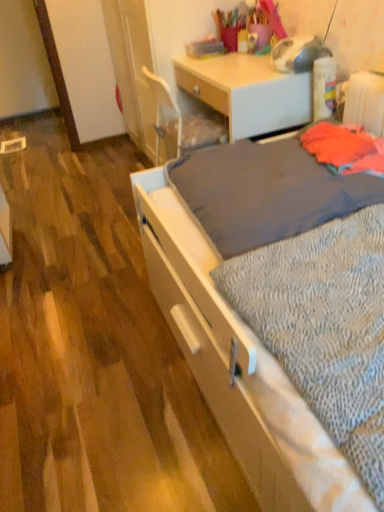
Question: Is matte wood desk at center far away from textured gray blanket at center?

Choices:
 (A) no
 (B) yes

Answer: (A)

Question: Considering the relative sizes of matte wood desk at center and textured gray blanket at center in the image provided, is matte wood desk at center wider than textured gray blanket at center?

Choices:
 (A) yes
 (B) no

Answer: (B)

Question: Considering the relative sizes of matte wood desk at center and textured gray blanket at center in the image provided, is matte wood desk at center smaller than textured gray blanket at center?

Choices:
 (A) yes
 (B) no

Answer: (B)

Question: Is the depth of matte wood desk at center less than that of textured gray blanket at center?

Choices:
 (A) yes
 (B) no

Answer: (B)

Question: Could textured gray blanket at center be considered to be inside matte wood desk at center?

Choices:
 (A) yes
 (B) no

Answer: (B)

Question: Is matte wood desk at center oriented away from textured gray blanket at center?

Choices:
 (A) yes
 (B) no

Answer: (B)

Question: Is gray textured sheet at center not within matte wood desk at center?

Choices:
 (A) yes
 (B) no

Answer: (A)

Question: Considering the relative positions of gray textured sheet at center and matte wood desk at center in the image provided, is gray textured sheet at center to the left of matte wood desk at center from the viewer's perspective?

Choices:
 (A) yes
 (B) no

Answer: (B)

Question: Can you confirm if gray textured sheet at center is shorter than matte wood desk at center?

Choices:
 (A) yes
 (B) no

Answer: (A)

Question: From the image's perspective, is gray textured sheet at center below matte wood desk at center?

Choices:
 (A) no
 (B) yes

Answer: (B)

Question: From a real-world perspective, is gray textured sheet at center beneath matte wood desk at center?

Choices:
 (A) yes
 (B) no

Answer: (B)

Question: Can you confirm if gray textured sheet at center is positioned to the right of matte wood desk at center?

Choices:
 (A) no
 (B) yes

Answer: (B)

Question: Is matte wood desk at center far from gray textured sheet at center?

Choices:
 (A) yes
 (B) no

Answer: (A)